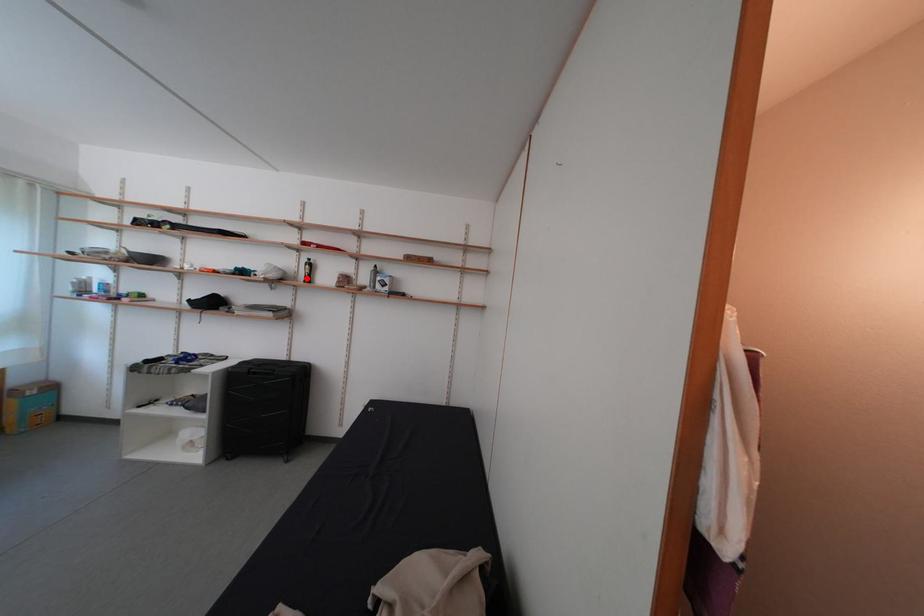
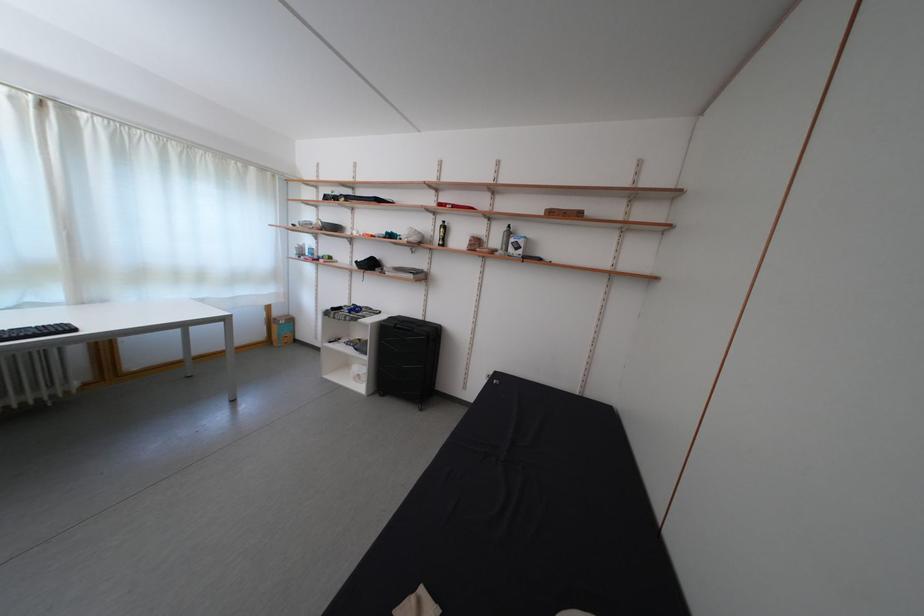
Where in the second image is the point corresponding to the highlighted location from the first image?

(442, 241)